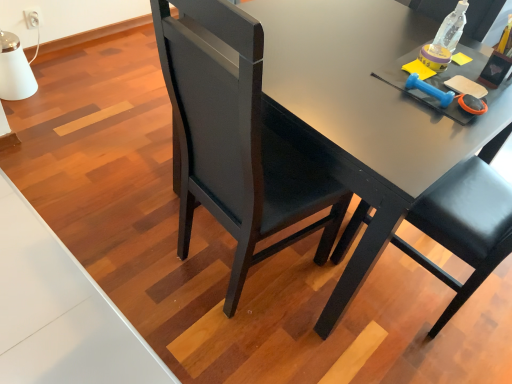
Question: From a real-world perspective, is clear plastic bottle at upper right located beneath matte black desk at center?

Choices:
 (A) no
 (B) yes

Answer: (A)

Question: From the image's perspective, does clear plastic bottle at upper right appear lower than matte black desk at center?

Choices:
 (A) yes
 (B) no

Answer: (B)

Question: Is clear plastic bottle at upper right wider than matte black desk at center?

Choices:
 (A) yes
 (B) no

Answer: (B)

Question: Would you say matte black desk at center is part of clear plastic bottle at upper right's contents?

Choices:
 (A) no
 (B) yes

Answer: (A)

Question: From a real-world perspective, is clear plastic bottle at upper right positioned over matte black desk at center based on gravity?

Choices:
 (A) yes
 (B) no

Answer: (A)

Question: From a real-world perspective, is black leather chair at center physically located above or below clear plastic bottle at upper right?

Choices:
 (A) above
 (B) below

Answer: (B)

Question: Considering the positions of black leather chair at center and clear plastic bottle at upper right in the image, is black leather chair at center wider or thinner than clear plastic bottle at upper right?

Choices:
 (A) thin
 (B) wide

Answer: (B)

Question: From the image's perspective, is black leather chair at center above or below clear plastic bottle at upper right?

Choices:
 (A) below
 (B) above

Answer: (A)

Question: Is black leather chair at center situated inside clear plastic bottle at upper right or outside?

Choices:
 (A) outside
 (B) inside

Answer: (A)

Question: From the image's perspective, relative to clear plastic bottle at upper right, is matte black desk at center above or below?

Choices:
 (A) above
 (B) below

Answer: (B)

Question: From a real-world perspective, is matte black desk at center positioned above or below clear plastic bottle at upper right?

Choices:
 (A) above
 (B) below

Answer: (B)

Question: In terms of height, does matte black desk at center look taller or shorter compared to clear plastic bottle at upper right?

Choices:
 (A) short
 (B) tall

Answer: (B)

Question: Looking at the image, does matte black desk at center seem bigger or smaller compared to clear plastic bottle at upper right?

Choices:
 (A) big
 (B) small

Answer: (A)

Question: Looking at their shapes, would you say clear plastic bottle at upper right is wider or thinner than matte black desk at center?

Choices:
 (A) thin
 (B) wide

Answer: (A)

Question: Considering their positions, is clear plastic bottle at upper right located in front of or behind matte black desk at center?

Choices:
 (A) behind
 (B) front

Answer: (A)